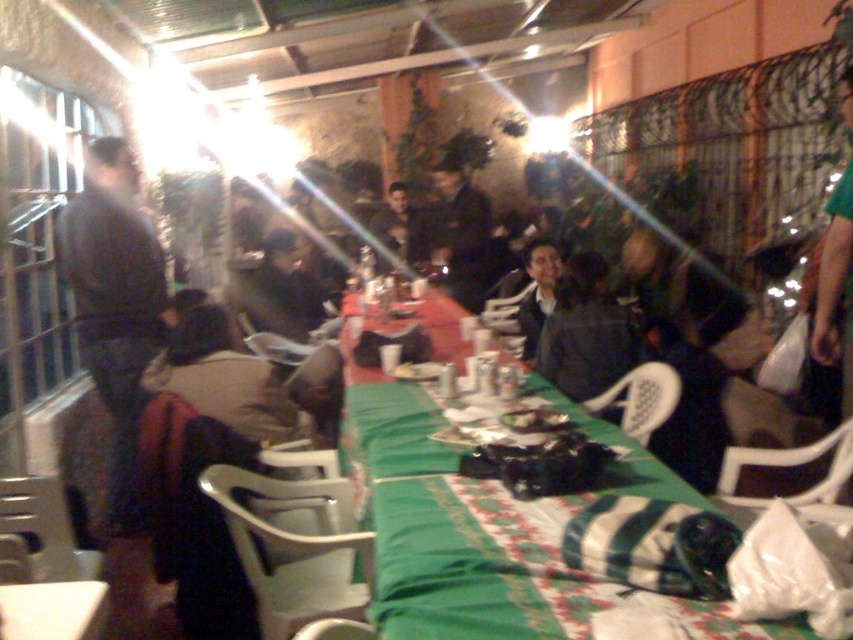
Question: Which is farther from the dark gray sweater at left?

Choices:
 (A) dark blue jacket at center
 (B) green fabric table at center
 (C) dark brown leather jacket at center
 (D) matte black jacket at center

Answer: (A)

Question: In this image, where is matte black jacket at center located relative to green fabric table at lower left?

Choices:
 (A) above
 (B) below

Answer: (A)

Question: Which of the following is the farthest from the observer?

Choices:
 (A) (283, 243)
 (B) (276, 420)

Answer: (A)

Question: Which object is positioned closest to the dark gray jacket at center?

Choices:
 (A) green fabric table at lower left
 (B) dark gray sweater at left
 (C) green fabric table at center

Answer: (C)

Question: Can you confirm if dark gray sweater at left is positioned above dark gray jacket at center?

Choices:
 (A) yes
 (B) no

Answer: (B)

Question: Does matte black jacket at center appear on the right side of dark blue jacket at center?

Choices:
 (A) yes
 (B) no

Answer: (B)